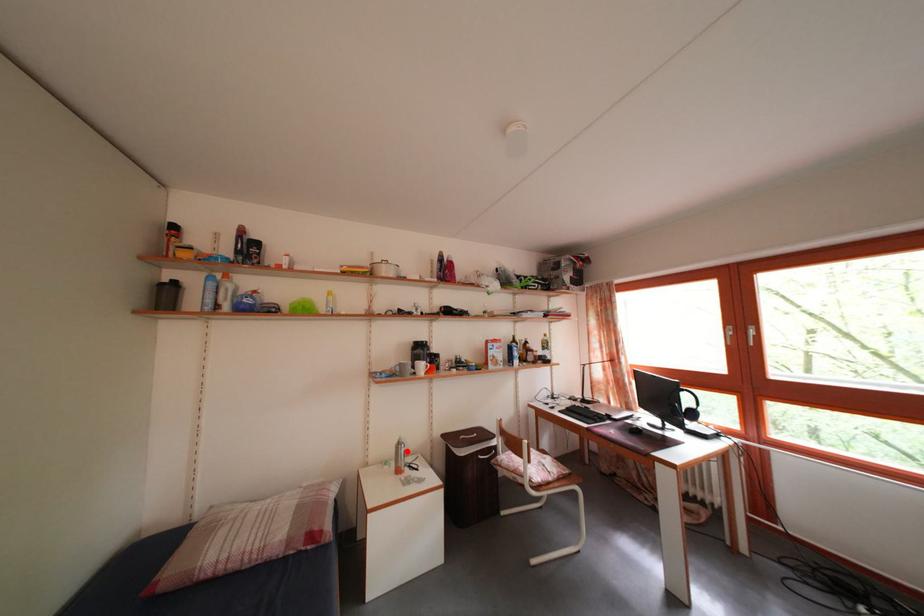
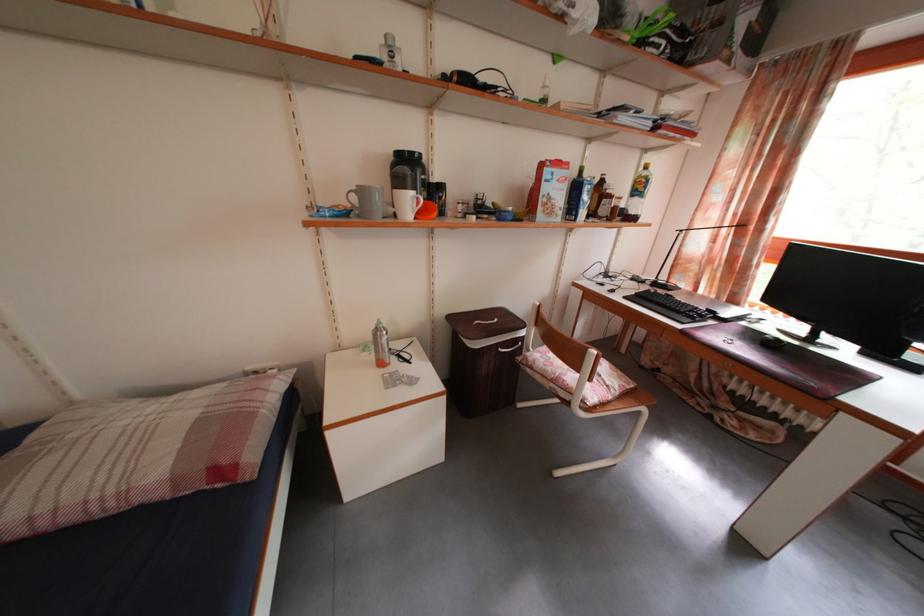
Question: I am providing you with two images of the same scene from different viewpoints. In image1, a red point is highlighted. Considering the same 3D point in image2, which of the following is correct?

Choices:
 (A) It is closer
 (B) It is farther

Answer: (A)